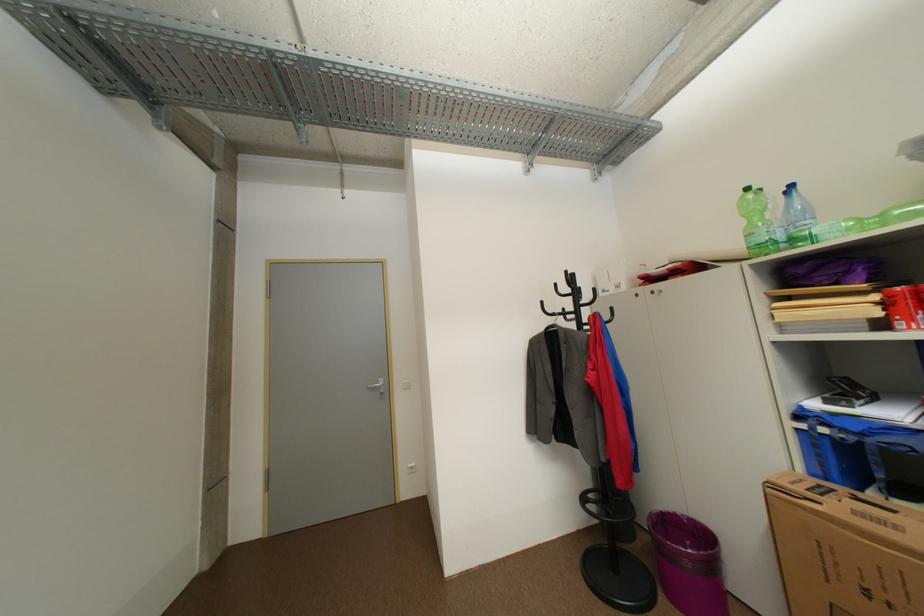
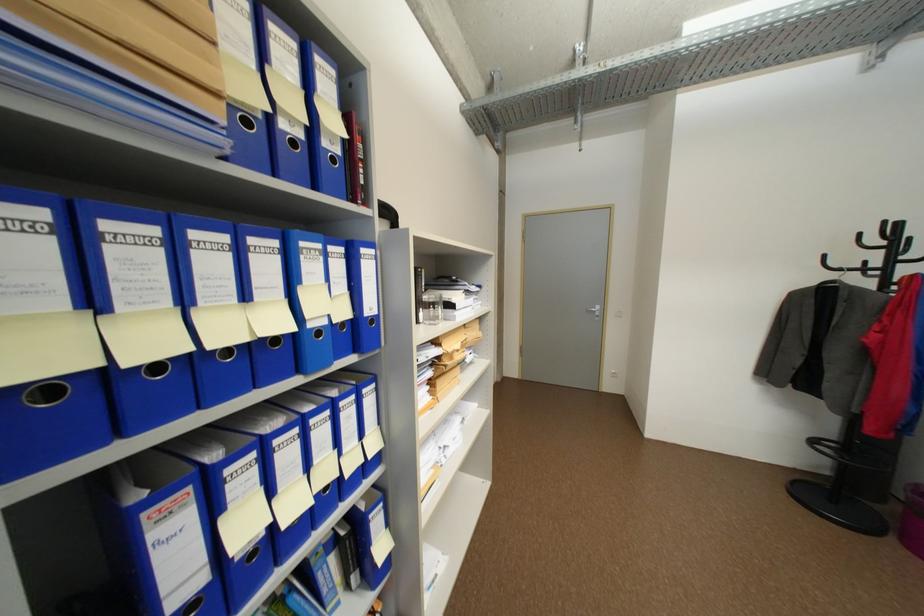
Locate, in the second image, the point that corresponds to (x=575, y=273) in the first image.

(893, 224)